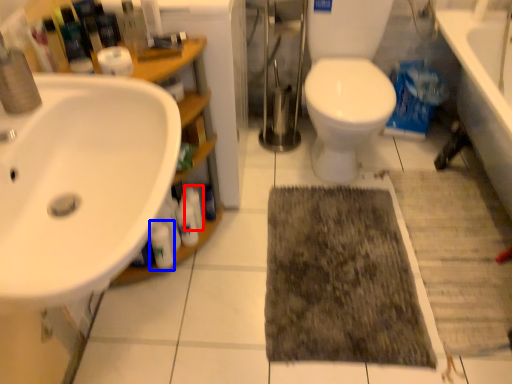
Question: Which object is closer to the camera taking this photo, toiletry (highlighted by a red box) or cleaning product (highlighted by a blue box)?

Choices:
 (A) toiletry
 (B) cleaning product

Answer: (B)